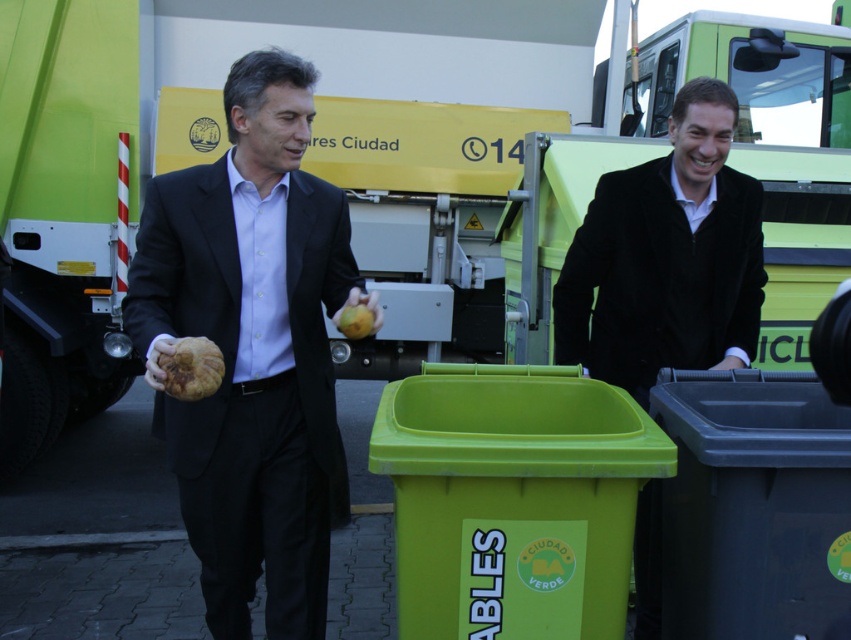
Between black plastic recycling bin at lower right and rotten brown fruit at lower left, which one is positioned lower?

Positioned lower is black plastic recycling bin at lower right.

Who is positioned more to the left, black plastic recycling bin at lower right or rotten brown fruit at lower left?

rotten brown fruit at lower left is more to the left.

Between point (826, 570) and point (191, 372), which one is positioned behind?

The point (826, 570) is more distant.

The height and width of the screenshot is (640, 851). Identify the location of black plastic recycling bin at lower right. (746, 508).

Can you confirm if green plastic bin at center is positioned to the left of smooth yellow fruit at center?

No, green plastic bin at center is not to the left of smooth yellow fruit at center.

Who is more distant from viewer, (592, 540) or (363, 305)?

The point (363, 305) is more distant.

Which is in front, point (530, 588) or point (353, 305)?

Point (530, 588)

Identify the location of green plastic bin at center. The height and width of the screenshot is (640, 851). (513, 499).

Which is behind, point (655, 253) or point (361, 307)?

Point (655, 253)

Can you confirm if black velvet suit at right is taller than smooth yellow fruit at center?

Correct, black velvet suit at right is much taller as smooth yellow fruit at center.

The image size is (851, 640). I want to click on black velvet suit at right, so click(x=660, y=278).

Where is `black velvet suit at right`? This screenshot has width=851, height=640. black velvet suit at right is located at coordinates (660, 278).